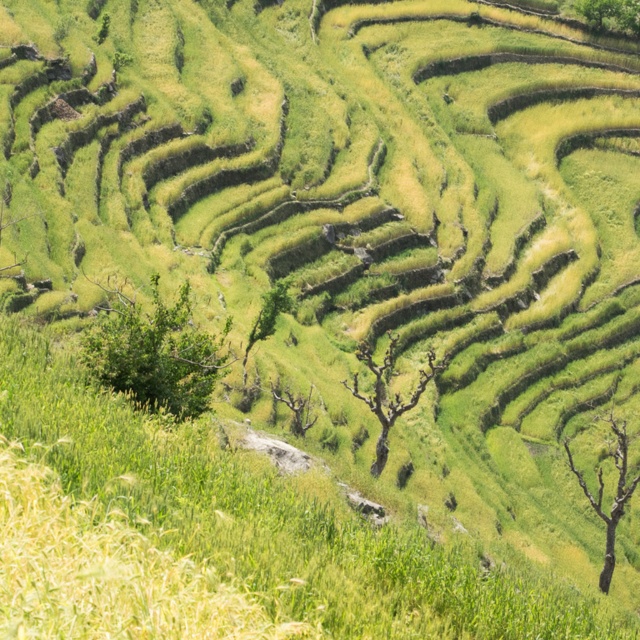
Question: Which point is farther to the camera?

Choices:
 (A) (602, 19)
 (B) (120, 292)
 (C) (586, 486)
 (D) (397, 401)

Answer: (A)

Question: Is bare wood tree at center bigger than bare wood tree at center-right?

Choices:
 (A) yes
 (B) no

Answer: (B)

Question: Is bare wood tree at center positioned before bare wood tree at center-right?

Choices:
 (A) yes
 (B) no

Answer: (B)

Question: Which of the following is the farthest from the observer?

Choices:
 (A) bare wood tree at center
 (B) green leafy tree at left

Answer: (A)

Question: Is green leafy tree at center above green leafy tree at upper right?

Choices:
 (A) yes
 (B) no

Answer: (B)

Question: Based on their relative distances, which object is farther from the green leafy tree at upper right?

Choices:
 (A) green leafy tree at center
 (B) green leafy tree at left
 (C) bare wood tree at center-right

Answer: (B)